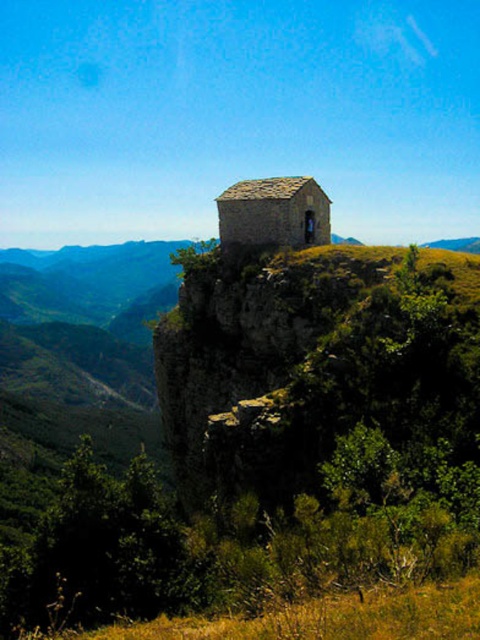
Question: Does brown rough rock at upper center appear on the right side of stone textured hut at center?

Choices:
 (A) yes
 (B) no

Answer: (B)

Question: Does brown rough rock at upper center have a smaller size compared to stone textured hut at center?

Choices:
 (A) yes
 (B) no

Answer: (B)

Question: Among these objects, which one is nearest to the camera?

Choices:
 (A) stone textured hut at center
 (B) brown rough rock at upper center

Answer: (B)

Question: Can you confirm if brown rough rock at upper center is positioned to the right of stone textured hut at center?

Choices:
 (A) yes
 (B) no

Answer: (B)